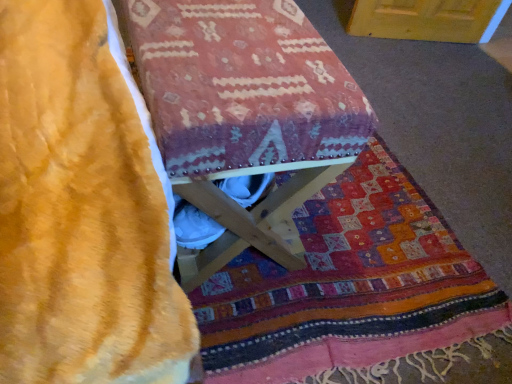
The width and height of the screenshot is (512, 384). I want to click on free location above wooden stool at center (from a real-world perspective), so click(241, 36).